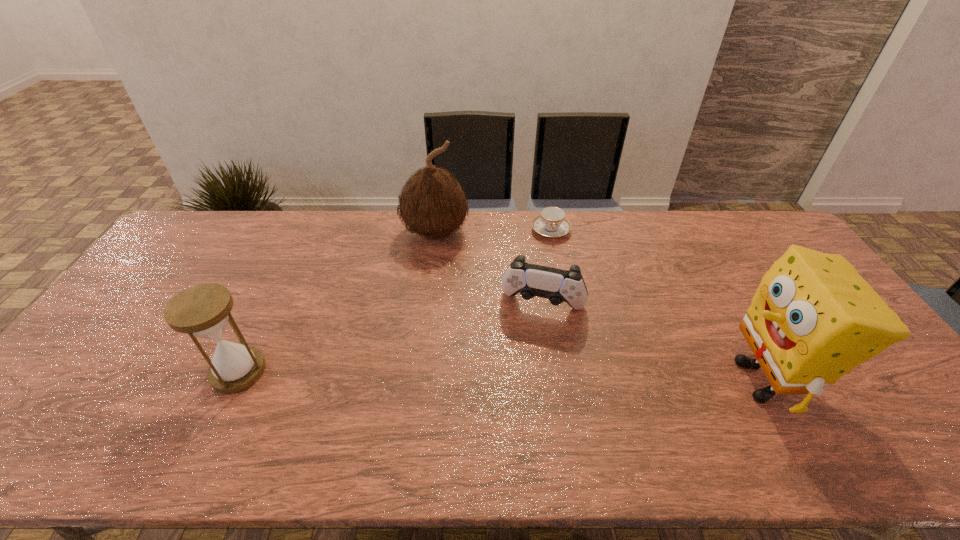
Identify the location of blank area in the image that satisfies the following two spatial constraints: 1. on the front side of the rightmost object; 2. on the face of the leftmost object. This screenshot has height=540, width=960. (234, 380).

Image resolution: width=960 pixels, height=540 pixels. I want to click on free space that satisfies the following two spatial constraints: 1. on the front side of the leftmost object; 2. on the face of the rightmost object, so (234, 380).

Find the location of a particular element. The height and width of the screenshot is (540, 960). vacant region that satisfies the following two spatial constraints: 1. on the front side of the coconut; 2. on the right side of the control is located at coordinates (427, 305).

The height and width of the screenshot is (540, 960). Find the location of `free space that satisfies the following two spatial constraints: 1. on the front side of the sponge; 2. on the face of the coconut`. free space that satisfies the following two spatial constraints: 1. on the front side of the sponge; 2. on the face of the coconut is located at coordinates (418, 380).